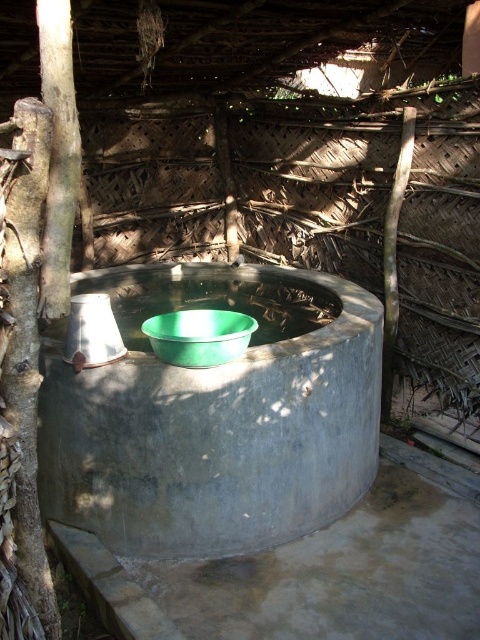
In the scene shown: You are standing in the rustic outdoor setting and want to place a 36 inch long wooden board between the gray concrete basin at center and the green plastic basin at center. Can the board fit between them?

The distance between the gray concrete basin at center and the green plastic basin at center is 38.27 inches, so the 36 inch long wooden board can fit between them since it is shorter than the available space.

You are standing in front of the rustic outdoor well enclosure. You see the gray concrete basin at center and the green plastic basin at center. Which basin is closer to you?

The gray concrete basin at center is closer to you because it is further to the viewer than the green plastic basin at center.